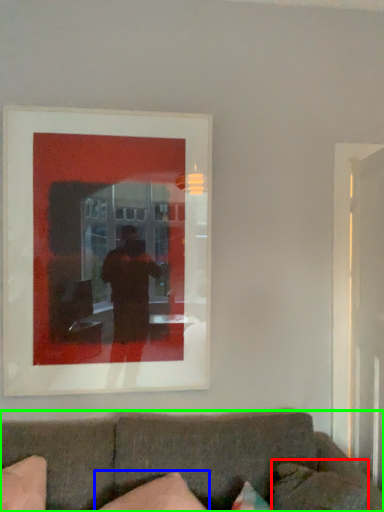
Question: Which is farther away from pillow (highlighted by a red box)? pillow (highlighted by a blue box) or studio couch (highlighted by a green box)?

Choices:
 (A) pillow
 (B) studio couch

Answer: (A)